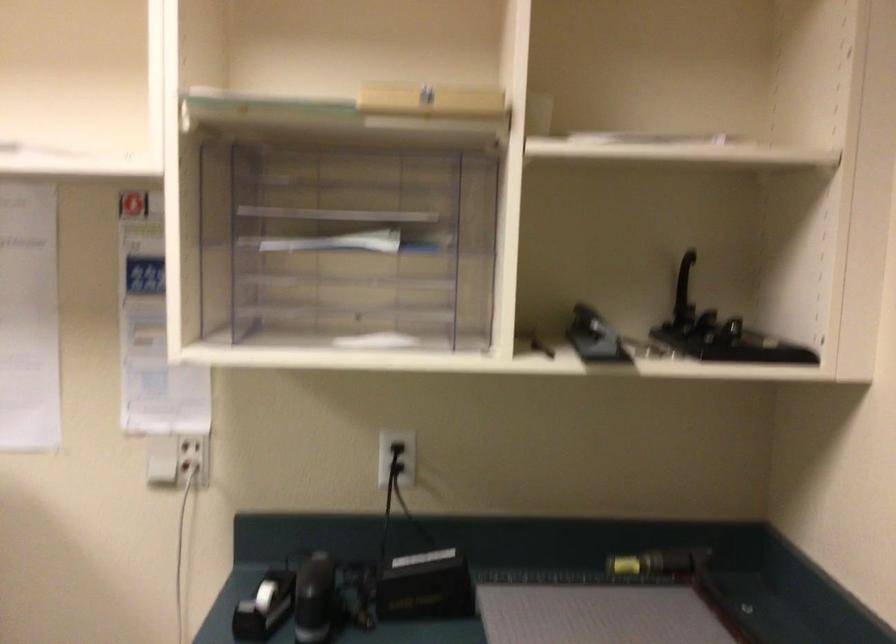
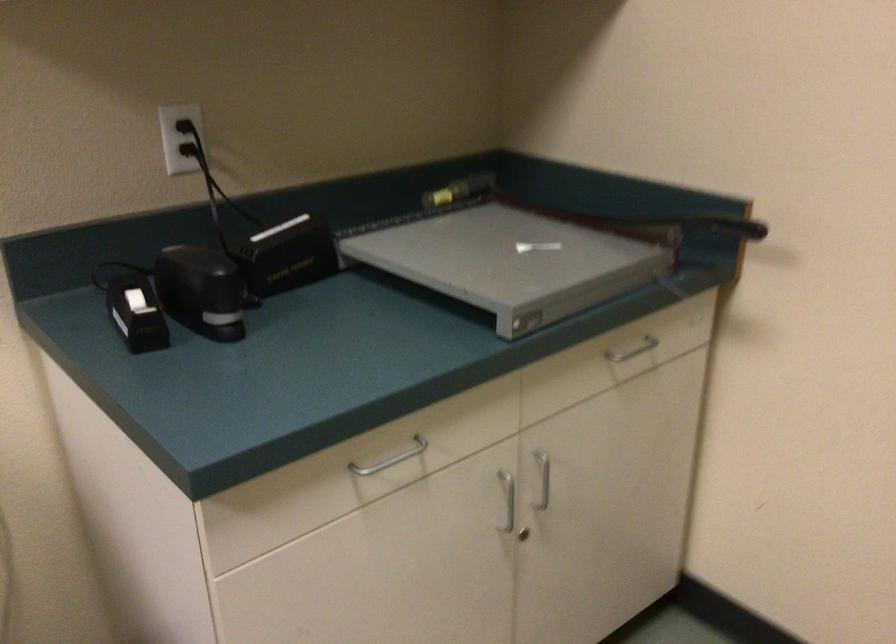
Where in the second image is the point corresponding to point (392, 451) from the first image?

(186, 128)